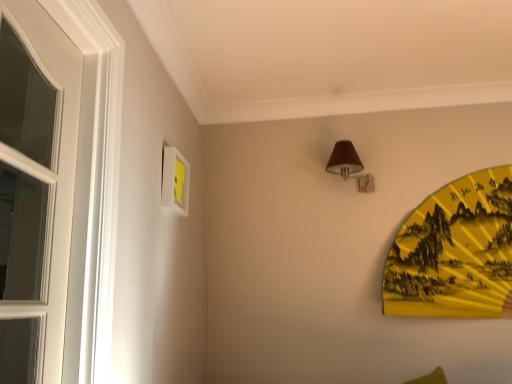
The width and height of the screenshot is (512, 384). Describe the element at coordinates (175, 181) in the screenshot. I see `white matte picture frame at upper left` at that location.

The width and height of the screenshot is (512, 384). What are the coordinates of `yellow paper fan at right` in the screenshot? It's located at (455, 252).

Which point is more distant from viewer, (352, 146) or (165, 201)?

The point (352, 146) is farther from the camera.

Can you confirm if brown fabric lampshade at upper center is wider than white matte picture frame at upper left?

Yes, brown fabric lampshade at upper center is wider than white matte picture frame at upper left.

Consider the image. Based on their sizes in the image, would you say brown fabric lampshade at upper center is bigger or smaller than white matte picture frame at upper left?

brown fabric lampshade at upper center is bigger than white matte picture frame at upper left.

Between point (179, 173) and point (506, 305), which one is positioned in front?

The point (179, 173) is more forward.

Consider the image. Could you tell me if white matte picture frame at upper left is turned towards yellow paper fan at right?

Yes, white matte picture frame at upper left is turned towards yellow paper fan at right.

From the image's perspective, does white matte picture frame at upper left appear lower than yellow paper fan at right?

No, from the image's perspective, white matte picture frame at upper left is not beneath yellow paper fan at right.

Can you tell me how much white matte picture frame at upper left and yellow paper fan at right differ in facing direction?

They differ by 89.3 degrees in their facing directions.

Is brown fabric lampshade at upper center beside yellow paper fan at right?

No, brown fabric lampshade at upper center is not making contact with yellow paper fan at right.

In the scene shown: Considering the relative positions of brown fabric lampshade at upper center and yellow paper fan at right in the image provided, is brown fabric lampshade at upper center to the right of yellow paper fan at right from the viewer's perspective?

Incorrect, brown fabric lampshade at upper center is not on the right side of yellow paper fan at right.

From a real-world perspective, is brown fabric lampshade at upper center physically located above or below yellow paper fan at right?

From a real-world perspective, brown fabric lampshade at upper center is physically above yellow paper fan at right.

Locate an element on the screen. lamp behind the white matte picture frame at upper left is located at coordinates (349, 165).

Is brown fabric lampshade at upper center at the back of white matte picture frame at upper left?

That's not correct — white matte picture frame at upper left is not looking away from brown fabric lampshade at upper center.

From the image's perspective, is white matte picture frame at upper left above brown fabric lampshade at upper center?

No, from the image's perspective, white matte picture frame at upper left is not on top of brown fabric lampshade at upper center.

From the picture: Are white matte picture frame at upper left and brown fabric lampshade at upper center located far from each other?

No, white matte picture frame at upper left is not far away from brown fabric lampshade at upper center.

Considering the sizes of yellow paper fan at right and brown fabric lampshade at upper center in the image, is yellow paper fan at right taller or shorter than brown fabric lampshade at upper center?

In the image, yellow paper fan at right appears to be taller than brown fabric lampshade at upper center.

Is yellow paper fan at right next to brown fabric lampshade at upper center?

yellow paper fan at right and brown fabric lampshade at upper center are clearly separated.

Measure the distance between yellow paper fan at right and brown fabric lampshade at upper center.

The distance of yellow paper fan at right from brown fabric lampshade at upper center is 20.89 inches.

Between yellow paper fan at right and white matte picture frame at upper left, which one has larger width?

yellow paper fan at right is wider.

Which is more distant, (426, 273) or (165, 183)?

Point (426, 273)

How distant is yellow paper fan at right from white matte picture frame at upper left?

The distance of yellow paper fan at right from white matte picture frame at upper left is 4.42 feet.

I want to click on design below the white matte picture frame at upper left (from a real-world perspective), so click(455, 252).

I want to click on picture frame on the left of brown fabric lampshade at upper center, so click(175, 181).

Locate an element on the screen. picture frame above the yellow paper fan at right (from a real-world perspective) is located at coordinates (175, 181).

From the image, which object appears to be nearer to brown fabric lampshade at upper center, white matte picture frame at upper left or yellow paper fan at right?

yellow paper fan at right is closer to brown fabric lampshade at upper center.

Which object lies nearer to the anchor point white matte picture frame at upper left, yellow paper fan at right or brown fabric lampshade at upper center?

brown fabric lampshade at upper center is positioned closer to the anchor white matte picture frame at upper left.

From the image, which object appears to be nearer to yellow paper fan at right, white matte picture frame at upper left or brown fabric lampshade at upper center?

brown fabric lampshade at upper center lies closer to yellow paper fan at right than the other object.

When comparing their distances from white matte picture frame at upper left, does brown fabric lampshade at upper center or yellow paper fan at right seem further?

yellow paper fan at right is positioned further to the anchor white matte picture frame at upper left.

Looking at the image, which one is located closer to yellow paper fan at right, brown fabric lampshade at upper center or white matte picture frame at upper left?

brown fabric lampshade at upper center.

Based on their spatial positions, is yellow paper fan at right or white matte picture frame at upper left closer to brown fabric lampshade at upper center?

yellow paper fan at right is positioned closer to the anchor brown fabric lampshade at upper center.

The image size is (512, 384). Identify the location of lamp situated between white matte picture frame at upper left and yellow paper fan at right from left to right. (349, 165).